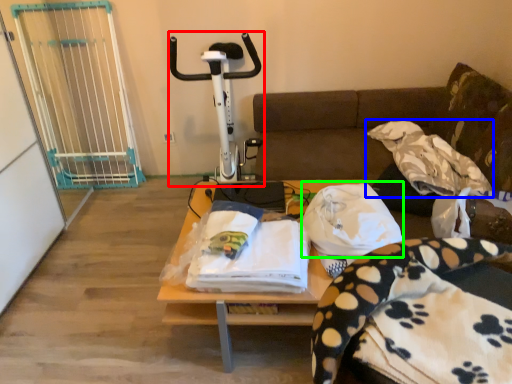
Question: Which is farther away from sport equipment (highlighted by a red box)? blanket (highlighted by a blue box) or cloth (highlighted by a green box)?

Choices:
 (A) blanket
 (B) cloth

Answer: (A)